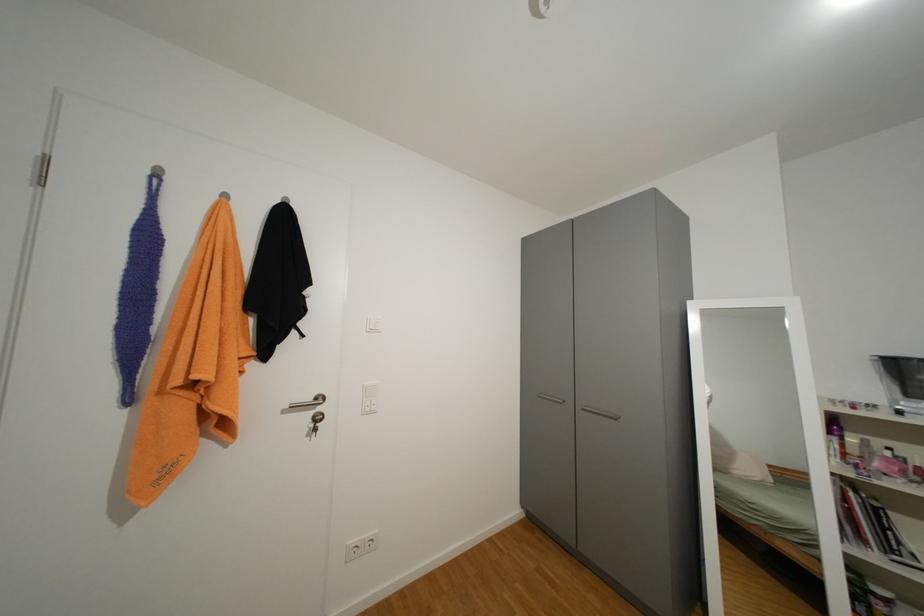
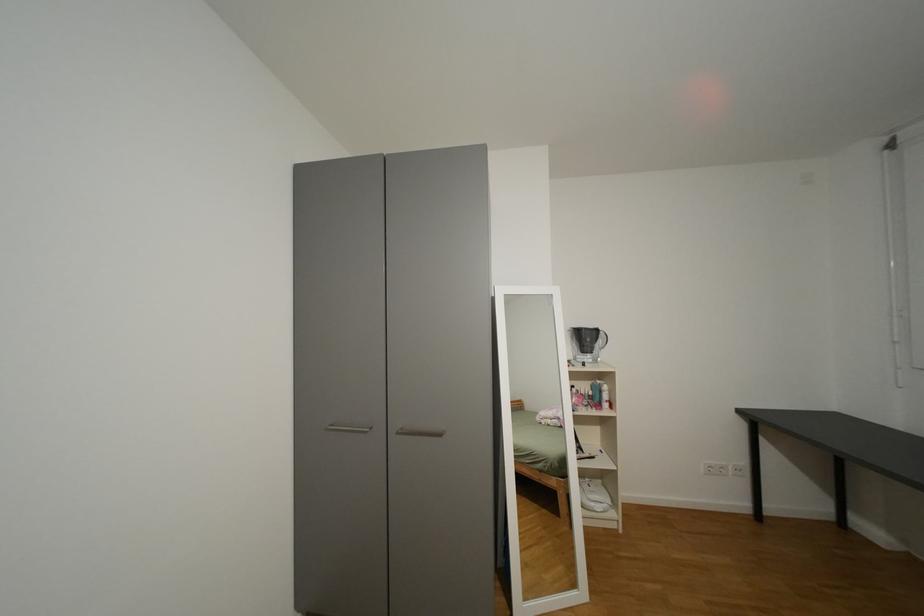
Question: Based on the continuous images, in which direction is the camera rotating? Reply with the corresponding letter.

Choices:
 (A) Left
 (B) Right
 (C) Up
 (D) Down

Answer: (B)